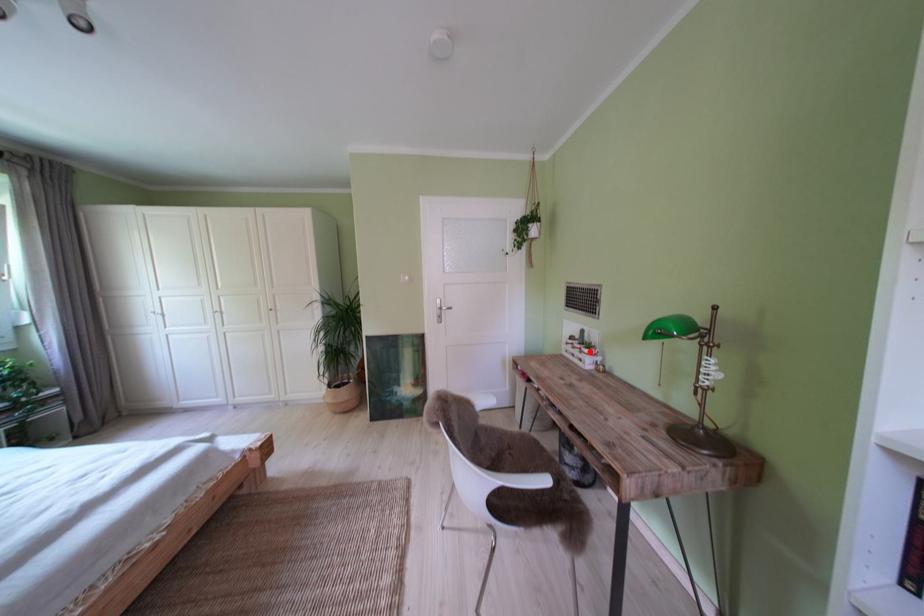
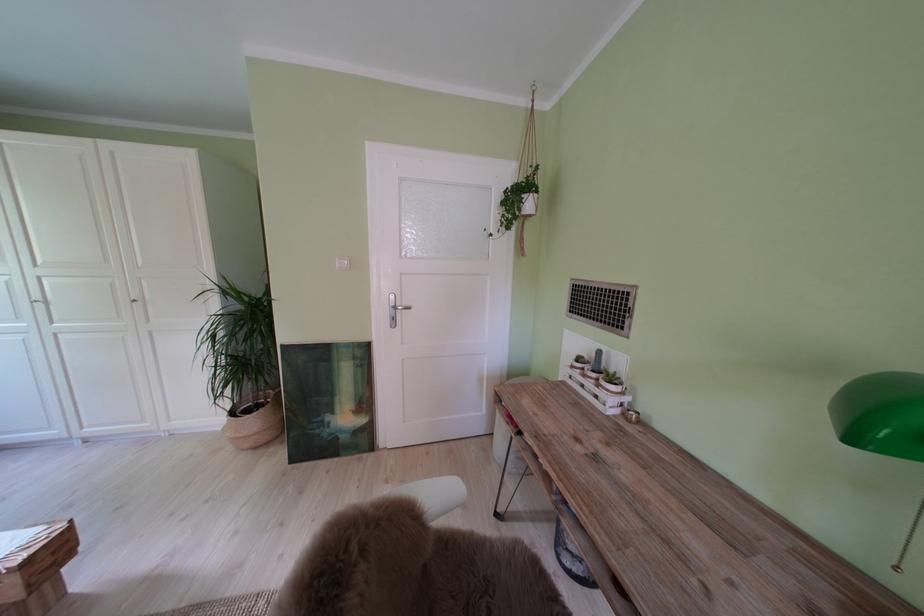
Where in the second image is the point corresponding to the highlighted location from the first image?

(604, 381)